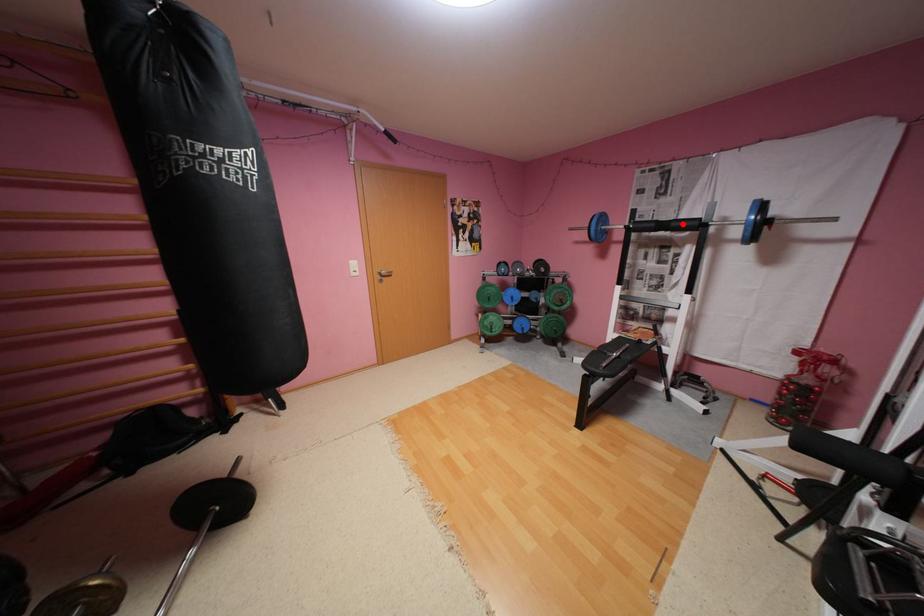
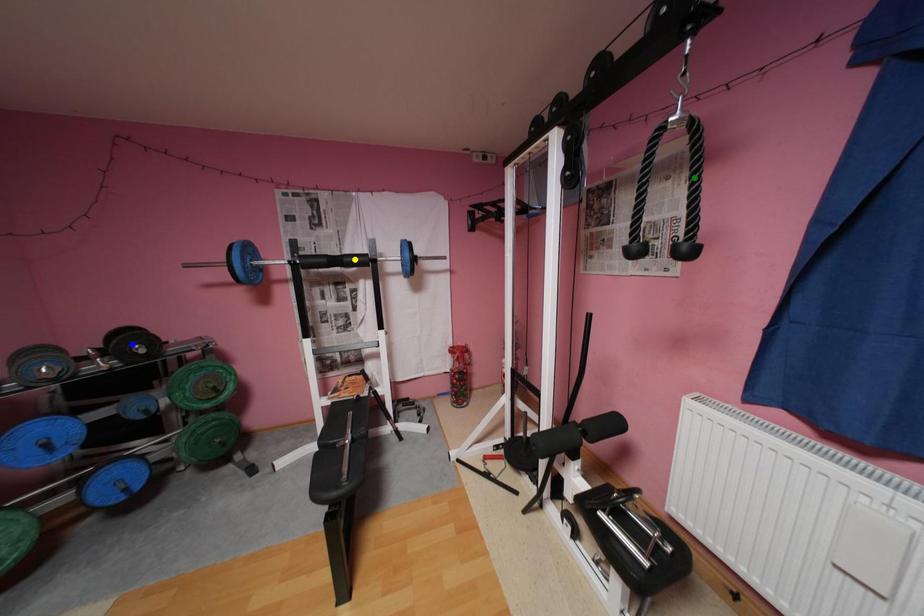
Question: I am providing you with two images of the same scene from different viewpoints. A red point is marked on the first image. You are given multiple points on the second image. Which mark in image 2 goes with the point in image 1?

Choices:
 (A) blue point
 (B) green point
 (C) yellow point

Answer: (C)